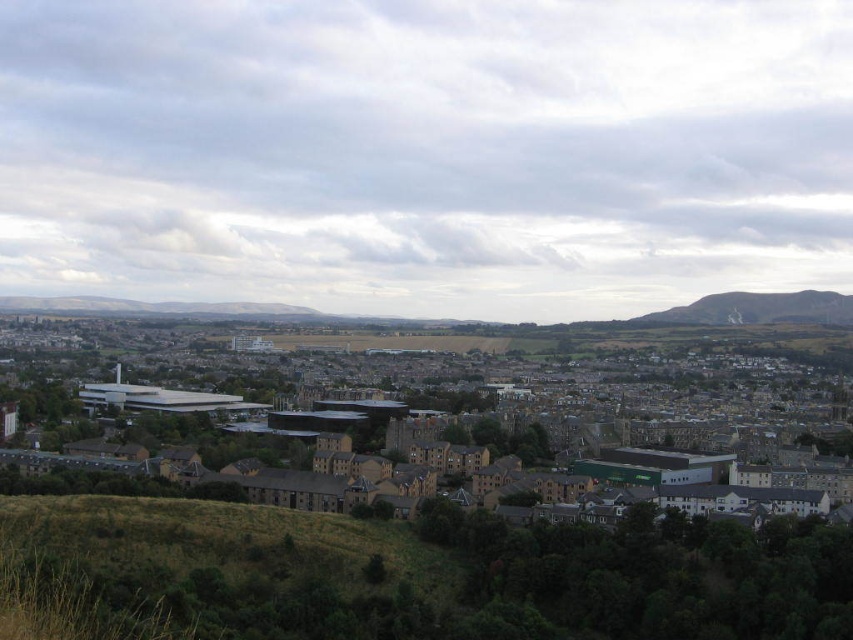
Question: Is brown stone buildings at center closer to the viewer compared to green grassy hill at right?

Choices:
 (A) no
 (B) yes

Answer: (B)

Question: Observing the image, what is the correct spatial positioning of brown stone buildings at center in reference to green grassy hill at right?

Choices:
 (A) right
 (B) left

Answer: (B)

Question: Which of the following is the farthest from the observer?

Choices:
 (A) (387, 497)
 (B) (779, 305)

Answer: (B)

Question: Which object is closer to the camera taking this photo?

Choices:
 (A) green grassy hill at right
 (B) brown stone buildings at center

Answer: (B)

Question: Among these objects, which one is farthest from the camera?

Choices:
 (A) green grassy hill at right
 (B) brown stone buildings at center

Answer: (A)

Question: Does brown stone buildings at center have a lesser width compared to green grassy hill at right?

Choices:
 (A) yes
 (B) no

Answer: (B)